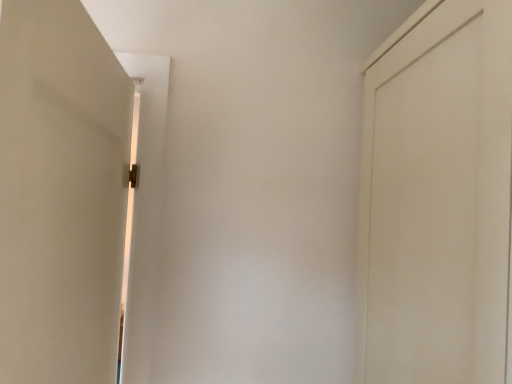
Question: Looking at the image, does white matte door at left, the second door from the right, seem bigger or smaller compared to white matte door at right, acting as the 1th door starting from the right?

Choices:
 (A) small
 (B) big

Answer: (A)

Question: Considering the positions of white matte door at left, which is the first door in left-to-right order, and white matte door at right, acting as the 1th door starting from the right, in the image, is white matte door at left, which is the first door in left-to-right order, wider or thinner than white matte door at right, acting as the 1th door starting from the right,?

Choices:
 (A) thin
 (B) wide

Answer: (A)

Question: Is white matte door at left, the second door from the right, inside the boundaries of white matte door at right, which is the 2th door in left-to-right order, or outside?

Choices:
 (A) outside
 (B) inside

Answer: (A)

Question: Is white matte door at right, acting as the 1th door starting from the right, bigger or smaller than white matte door at left, the second door from the right?

Choices:
 (A) small
 (B) big

Answer: (B)

Question: From the image's perspective, relative to white matte door at left, which is the first door in left-to-right order, is white matte door at right, acting as the 1th door starting from the right, above or below?

Choices:
 (A) above
 (B) below

Answer: (A)

Question: From a real-world perspective, relative to white matte door at left, the second door from the right, is white matte door at right, which is the 2th door in left-to-right order, vertically above or below?

Choices:
 (A) above
 (B) below

Answer: (A)

Question: Looking at their shapes, would you say white matte door at right, which is the 2th door in left-to-right order, is wider or thinner than white matte door at left, the second door from the right?

Choices:
 (A) thin
 (B) wide

Answer: (B)